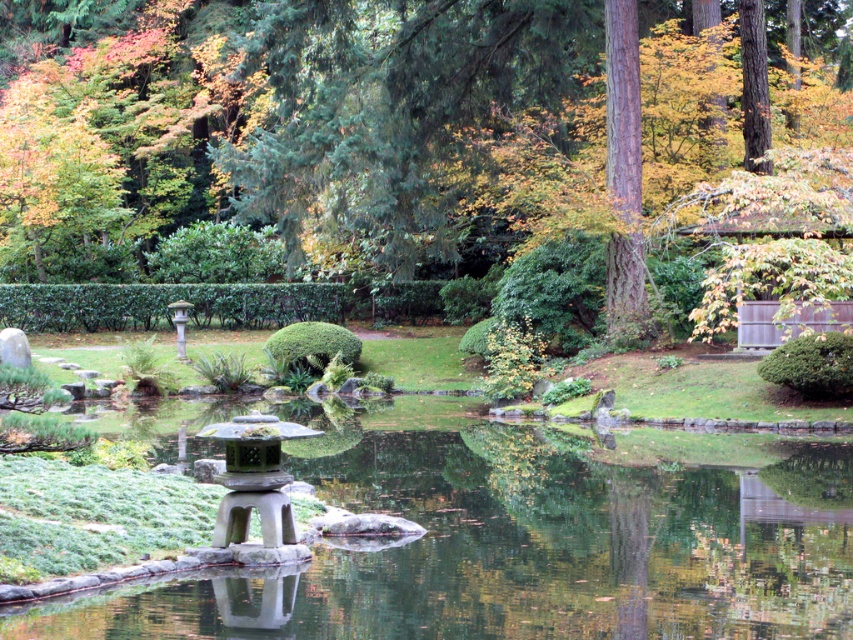
Between green leafy hedge at center and smooth stone lantern at center, which one is positioned higher?

green leafy hedge at center is higher up.

Does green leafy hedge at center have a larger size compared to smooth stone lantern at center?

Yes.

Which is behind, point (311, 308) or point (289, 506)?

The point (311, 308) is more distant.

Locate an element on the screen. green leafy hedge at center is located at coordinates (207, 305).

Between brown textured tree at upper center and green textured bush at right, which one is positioned lower?

green textured bush at right is lower down.

In the scene shown: Does brown textured tree at upper center have a greater height compared to green textured bush at right?

Yes, brown textured tree at upper center is taller than green textured bush at right.

Does point (434, 38) come closer to viewer compared to point (815, 348)?

No, it is behind (815, 348).

Image resolution: width=853 pixels, height=640 pixels. Find the location of `brown textured tree at upper center`. brown textured tree at upper center is located at coordinates (283, 131).

Who is lower down, brown textured tree at upper center or smooth stone lantern at center?

smooth stone lantern at center is below.

Is point (364, 99) closer to viewer compared to point (277, 436)?

No, it is behind (277, 436).

Locate an element on the screen. brown textured tree at upper center is located at coordinates (283, 131).